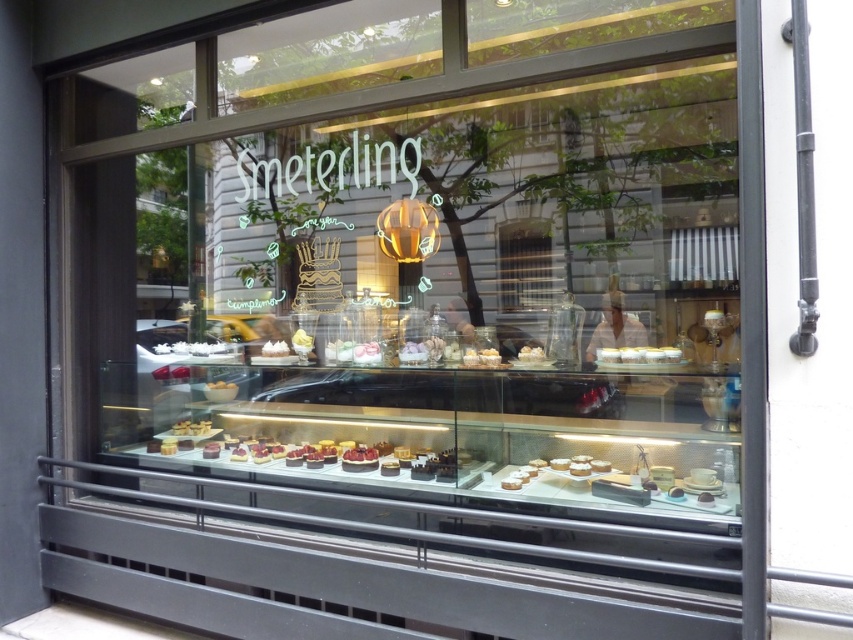
Who is more forward, (x=260, y=349) or (x=520, y=356)?

Point (x=520, y=356) is more forward.

Can you confirm if white cream cake at center is positioned to the left of white glossy cake at center?

Indeed, white cream cake at center is positioned on the left side of white glossy cake at center.

Is point (288, 348) more distant than point (532, 352)?

Yes.

The image size is (853, 640). I want to click on white cream cake at center, so click(276, 348).